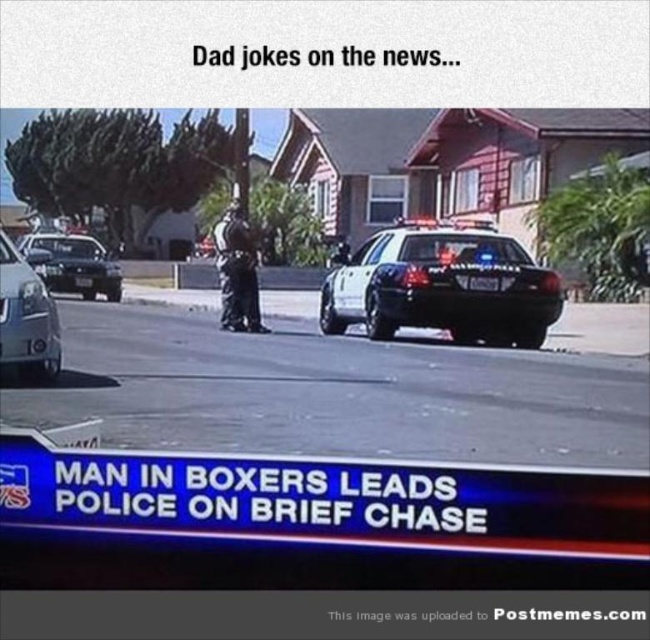
Between black glossy sedan at center and dark gray uniform at center, which one has less height?

black glossy sedan at center is shorter.

Can you confirm if black glossy sedan at center is taller than dark gray uniform at center?

No.

Measure the distance between point [98,269] and camera.

The distance of point [98,269] from camera is 20.82 meters.

In order to click on black glossy sedan at center in this screenshot , I will do `click(73, 264)`.

Does white glossy police car at center lie behind black glossy sedan at center?

No, white glossy police car at center is in front of black glossy sedan at center.

Can you confirm if white glossy police car at center is smaller than black glossy sedan at center?

Correct, white glossy police car at center occupies less space than black glossy sedan at center.

Who is more distant from viewer, (x=469, y=285) or (x=88, y=285)?

The point (x=88, y=285) is behind.

Where is `white glossy police car at center`? Image resolution: width=650 pixels, height=640 pixels. white glossy police car at center is located at coordinates (442, 285).

Can you confirm if white glossy police car at center is shorter than silver metallic sedan at lower left?

In fact, white glossy police car at center may be taller than silver metallic sedan at lower left.

Does white glossy police car at center come behind silver metallic sedan at lower left?

That is True.

Who is more forward, [330,289] or [3,266]?

Point [3,266] is more forward.

This screenshot has height=640, width=650. I want to click on white glossy police car at center, so click(442, 285).